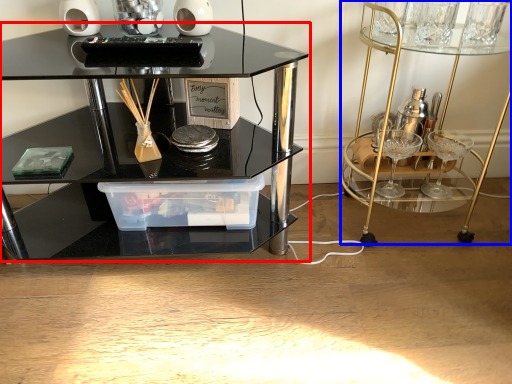
Question: Which point is further to the camera, table (highlighted by a red box) or vanity (highlighted by a blue box)?

Choices:
 (A) table
 (B) vanity

Answer: (B)